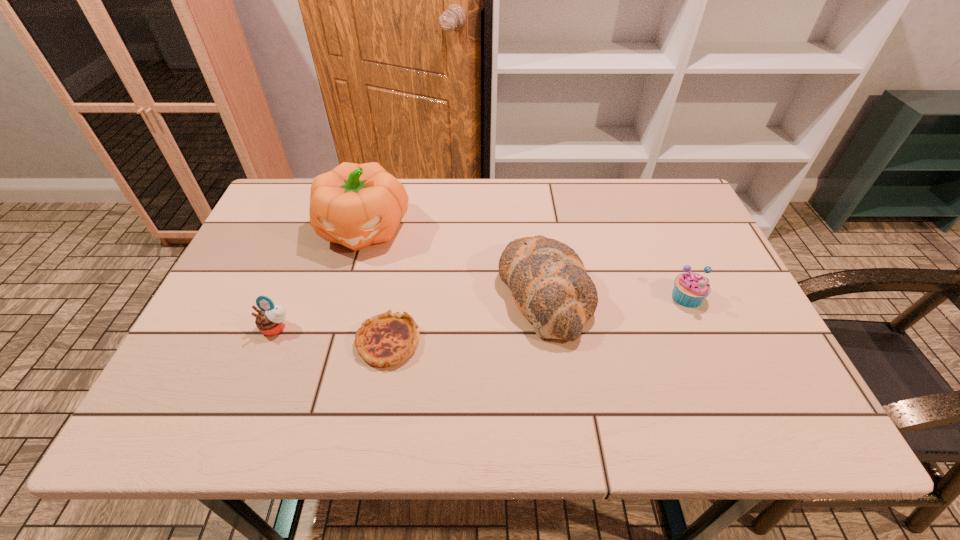
Where is `the third closest object to the fourth shortest object`? The width and height of the screenshot is (960, 540). the third closest object to the fourth shortest object is located at coordinates (356, 205).

I want to click on object that stands as the third closest to the farther muffin, so click(x=356, y=205).

At what (x,y) coordinates should I click in order to perform the action: click on vacant space that satisfies the following two spatial constraints: 1. on the carved face of the farther muffin; 2. on the right side of the tallest object. Please return your answer as a coordinate pair (x, y). Image resolution: width=960 pixels, height=540 pixels. Looking at the image, I should click on (345, 297).

Locate an element on the screen. The image size is (960, 540). vacant space that satisfies the following two spatial constraints: 1. on the carved face of the quiche; 2. on the left side of the tallest object is located at coordinates (331, 342).

The height and width of the screenshot is (540, 960). Identify the location of blank space that satisfies the following two spatial constraints: 1. on the back side of the quiche; 2. on the right side of the rightmost object. (396, 297).

This screenshot has height=540, width=960. What are the coordinates of `vacant space that satisfies the following two spatial constraints: 1. on the carved face of the pumpkin; 2. on the left side of the second tallest object` in the screenshot? It's located at (346, 292).

Identify the location of free spot that satisfies the following two spatial constraints: 1. on the front-facing side of the nearer muffin; 2. on the left side of the quiche. The width and height of the screenshot is (960, 540). (271, 342).